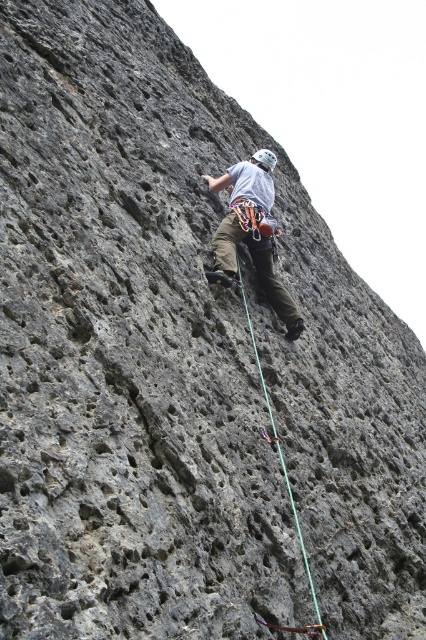
You are a rock climber preparing to attach your gear. You have a matte gray climbing harness at center and a green nylon rope at center. Which item is wider?

The matte gray climbing harness at center is wider than the green nylon rope at center.

Consider the image. You are a rock climber trying to reach the top of the cliff. You notice a point marked at coordinates (250, 232) on your climbing map. According to the map, what object is located at this specific coordinate?

The point at coordinates (250, 232) marks the matte gray climbing harness at center.

You are a safety inspector checking the climbing setup. The recommended safe distance between the matte gray climbing harness at center and the green nylon rope at center should be at least 30 feet. Based on the image, is the current setup within safety guidelines?

The matte gray climbing harness at center is 29.40 feet from the green nylon rope at center. Since the minimum required distance is 30 feet, the current setup does not meet safety guidelines as it is 0.6 feet too short.